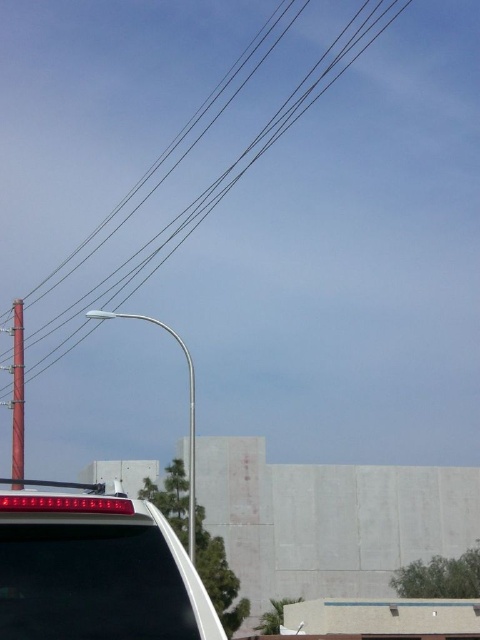
Looking at this image, does matte black car at lower left lie in front of smooth brown wooden pole at left?

Yes.

Which is behind, point (101, 536) or point (12, 328)?

The point (12, 328) is behind.

Who is more forward, [17,545] or [12,440]?

Point [17,545] is in front.

Locate an element on the screen. This screenshot has height=640, width=480. matte black car at lower left is located at coordinates (96, 572).

Who is more forward, (360,8) or (13,412)?

Point (13,412)

Where is `black wire at upper left`? black wire at upper left is located at coordinates (215, 184).

Image resolution: width=480 pixels, height=640 pixels. I want to click on black wire at upper left, so click(215, 184).

Is matte black car at lower left closer to the viewer compared to black wire at upper left?

That is True.

Is matte black car at lower left below black wire at upper left?

Indeed, matte black car at lower left is positioned under black wire at upper left.

Measure the distance between point (104, 572) and camera.

They are 3.77 meters apart.

The height and width of the screenshot is (640, 480). I want to click on matte black car at lower left, so click(96, 572).